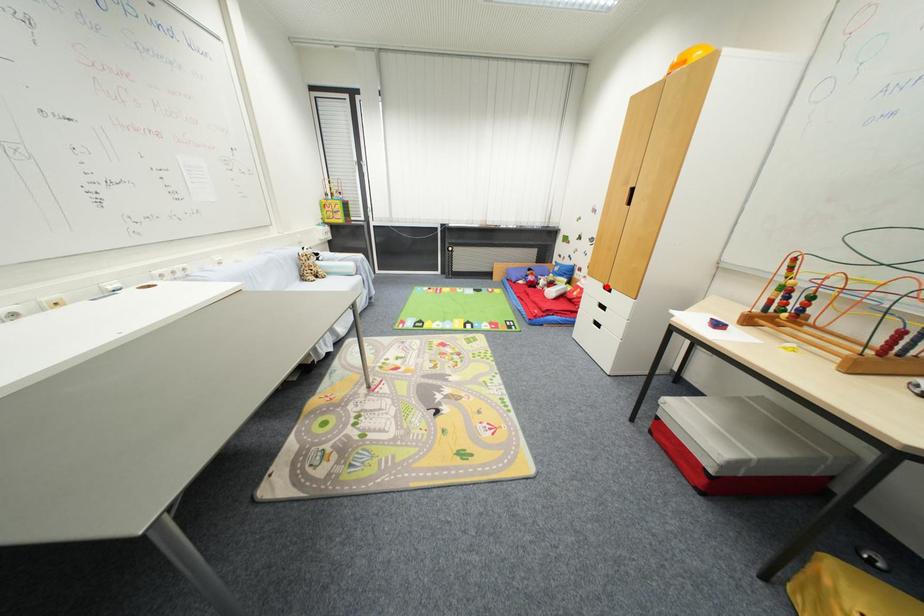
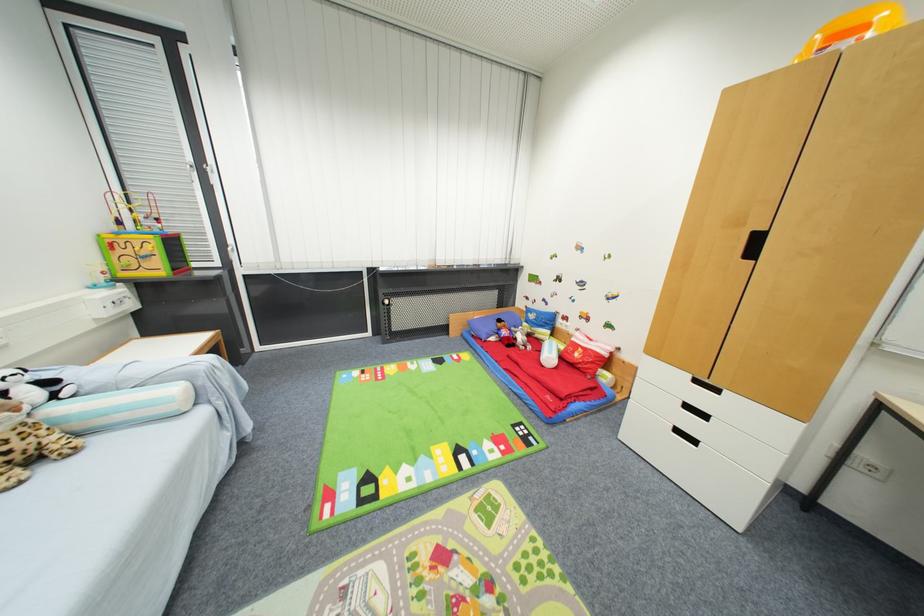
Question: I am providing you with two images of the same scene from different viewpoints. In image1, a red point is highlighted. Considering the same 3D point in image2, which of the following is correct?

Choices:
 (A) It is closer
 (B) It is farther

Answer: (B)